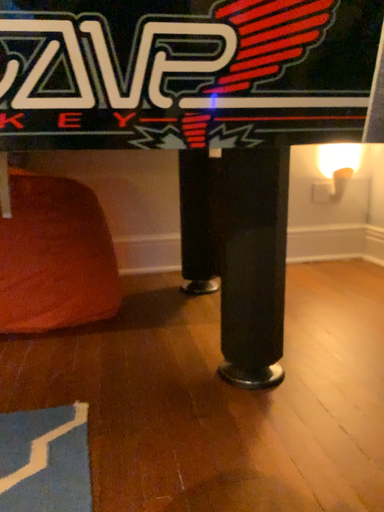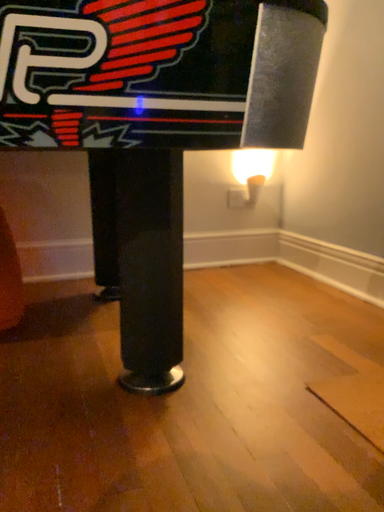
Question: How did the camera likely rotate when shooting the video?

Choices:
 (A) rotated left
 (B) rotated right

Answer: (B)